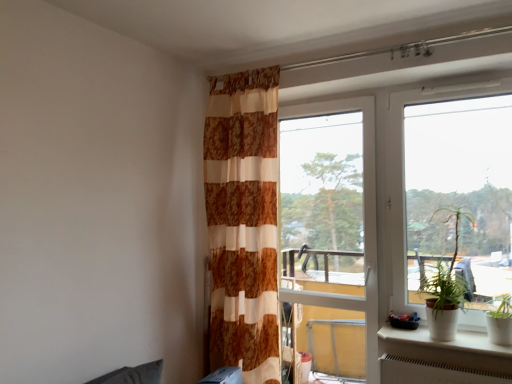
I want to click on free space above transparent glass window at right (from a real-world perspective), so [x=441, y=69].